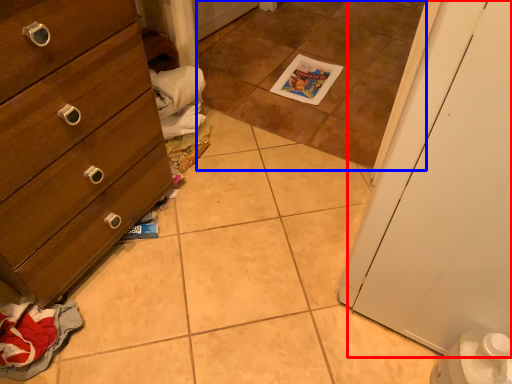
Question: Which object appears farthest to the camera in this image, door (highlighted by a red box) or tile (highlighted by a blue box)?

Choices:
 (A) door
 (B) tile

Answer: (B)